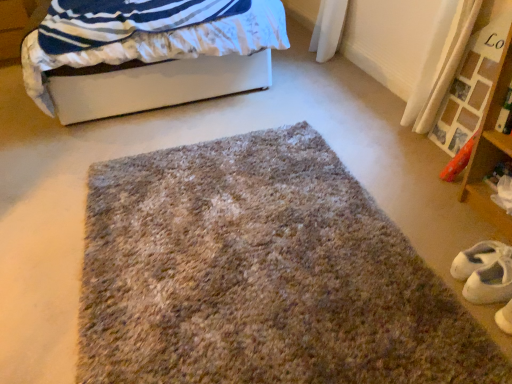
Question: Can you confirm if white suede shoe at lower right is wider than fuzzy carpet at center?

Choices:
 (A) yes
 (B) no

Answer: (B)

Question: Does white suede shoe at lower right contain fuzzy carpet at center?

Choices:
 (A) no
 (B) yes

Answer: (A)

Question: Does white suede shoe at lower right have a greater height compared to fuzzy carpet at center?

Choices:
 (A) no
 (B) yes

Answer: (B)

Question: Is white suede shoe at lower right oriented away from fuzzy carpet at center?

Choices:
 (A) yes
 (B) no

Answer: (B)

Question: Is white suede shoe at lower right positioned before fuzzy carpet at center?

Choices:
 (A) yes
 (B) no

Answer: (B)

Question: Is white suede shoe at lower right inside the boundaries of wooden shelf at right, or outside?

Choices:
 (A) outside
 (B) inside

Answer: (A)

Question: Is white suede shoe at lower right bigger or smaller than wooden shelf at right?

Choices:
 (A) big
 (B) small

Answer: (B)

Question: Does point (457, 279) appear closer or farther from the camera than point (461, 182)?

Choices:
 (A) farther
 (B) closer

Answer: (B)

Question: Is white suede shoe at lower right wider or thinner than wooden shelf at right?

Choices:
 (A) wide
 (B) thin

Answer: (B)

Question: Is white smooth bed at upper left spatially inside fuzzy carpet at center, or outside of it?

Choices:
 (A) outside
 (B) inside

Answer: (A)

Question: Looking at the image, does white smooth bed at upper left seem bigger or smaller compared to fuzzy carpet at center?

Choices:
 (A) big
 (B) small

Answer: (A)

Question: Considering their positions, is white smooth bed at upper left located in front of or behind fuzzy carpet at center?

Choices:
 (A) behind
 (B) front

Answer: (A)

Question: From the image's perspective, is white smooth bed at upper left above or below fuzzy carpet at center?

Choices:
 (A) above
 (B) below

Answer: (A)

Question: Looking at the image, does white smooth bed at upper left seem bigger or smaller compared to white suede shoe at lower right?

Choices:
 (A) big
 (B) small

Answer: (A)

Question: In the image, is white smooth bed at upper left positioned in front of or behind white suede shoe at lower right?

Choices:
 (A) front
 (B) behind

Answer: (B)